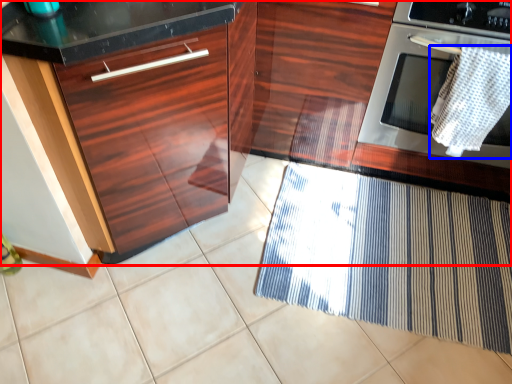
Question: Which object is further to the camera taking this photo, cabinetry (highlighted by a red box) or blanket (highlighted by a blue box)?

Choices:
 (A) cabinetry
 (B) blanket

Answer: (B)